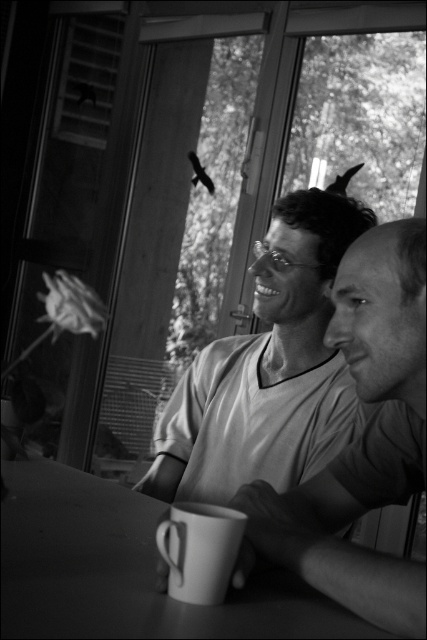
Question: Which point is farther to the camera?

Choices:
 (A) (94, 586)
 (B) (178, 516)

Answer: (A)

Question: Which point is closer to the camera?

Choices:
 (A) smooth white shirt at center
 (B) smooth matte table at center

Answer: (B)

Question: Is smooth matte table at center smaller than white matte mug at lower center?

Choices:
 (A) yes
 (B) no

Answer: (B)

Question: Is smooth matte table at center to the left of white matte mug at lower center from the viewer's perspective?

Choices:
 (A) no
 (B) yes

Answer: (B)

Question: Which of the following is the closest to the observer?

Choices:
 (A) smooth matte table at center
 (B) white matte mug at lower center
 (C) smooth white shirt at center

Answer: (A)

Question: Does smooth white shirt at center appear under smooth matte table at center?

Choices:
 (A) yes
 (B) no

Answer: (B)